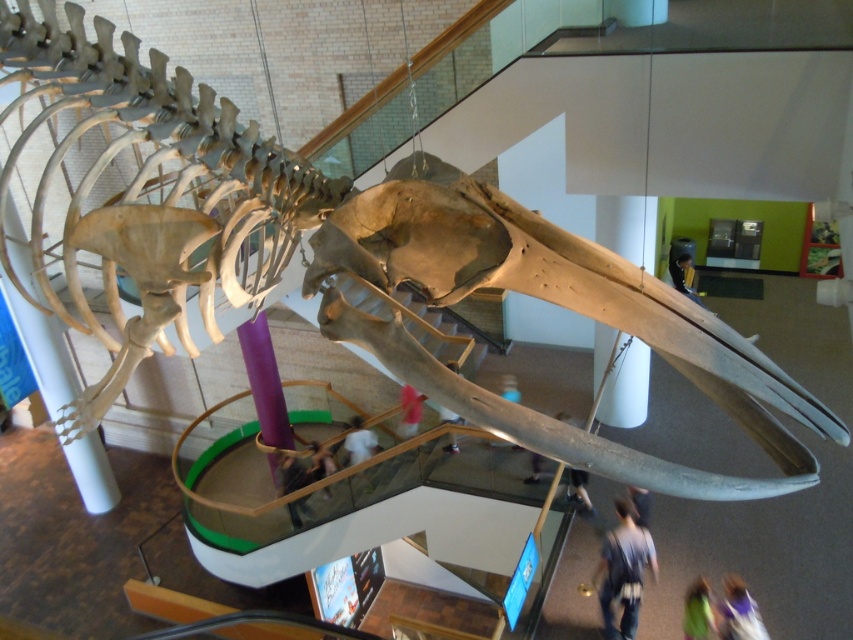
Question: Considering the relative positions of green fabric at lower right and smooth skin person at center in the image provided, where is green fabric at lower right located with respect to smooth skin person at center?

Choices:
 (A) below
 (B) above

Answer: (A)

Question: Is light brown leather jacket at lower center to the right of smooth brown hair at center from the viewer's perspective?

Choices:
 (A) no
 (B) yes

Answer: (A)

Question: Which is farther from the smooth brown hair at center?

Choices:
 (A) smooth skin person at center
 (B) green fabric at lower right
 (C) purple fabric at lower right
 (D) pink fabric at lower center

Answer: (C)

Question: Which object is farther from the camera taking this photo?

Choices:
 (A) smooth brown hair at center
 (B) light brown leather jacket at lower center

Answer: (A)

Question: Does green fabric at lower right appear over smooth skin person at center?

Choices:
 (A) yes
 (B) no

Answer: (B)

Question: Which point appears farthest from the camera in this image?

Choices:
 (A) (744, 595)
 (B) (697, 586)
 (C) (444, 408)

Answer: (C)